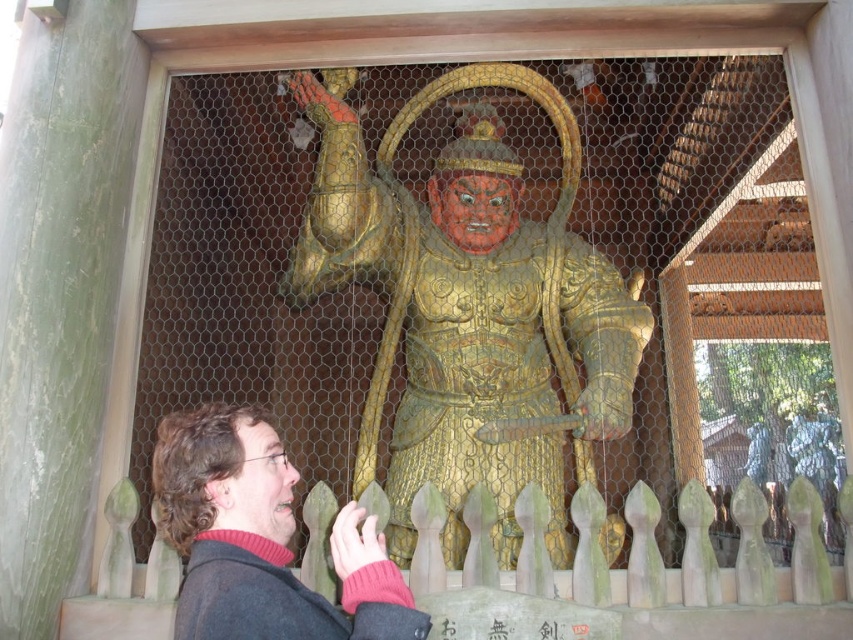
Question: Does gold textured armor at center have a larger size compared to dark brown hair at lower left?

Choices:
 (A) no
 (B) yes

Answer: (B)

Question: Which of the following is the farthest from the observer?

Choices:
 (A) dark brown hair at lower left
 (B) gold textured armor at center

Answer: (B)

Question: Is gold textured armor at center positioned before dark brown hair at lower left?

Choices:
 (A) no
 (B) yes

Answer: (A)

Question: Which of the following is the closest to the observer?

Choices:
 (A) (355, 576)
 (B) (410, 310)

Answer: (A)

Question: Can you confirm if gold textured armor at center is wider than dark brown hair at lower left?

Choices:
 (A) no
 (B) yes

Answer: (B)